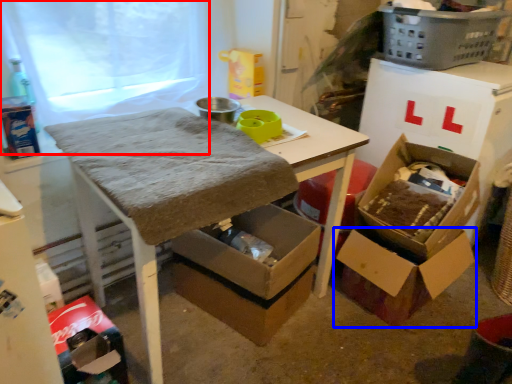
Question: Which of the following is the farthest to the observer, window screen (highlighted by a red box) or box (highlighted by a blue box)?

Choices:
 (A) window screen
 (B) box

Answer: (B)